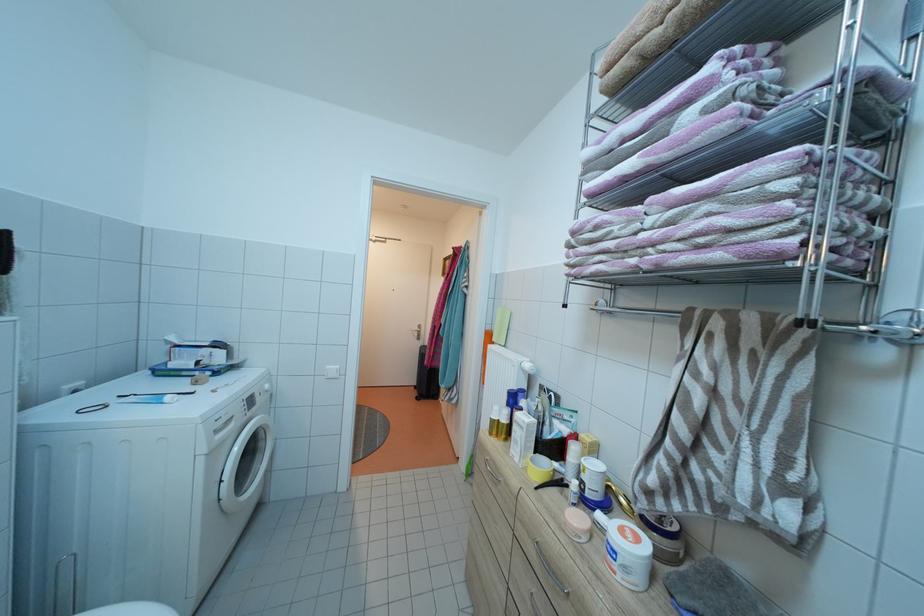
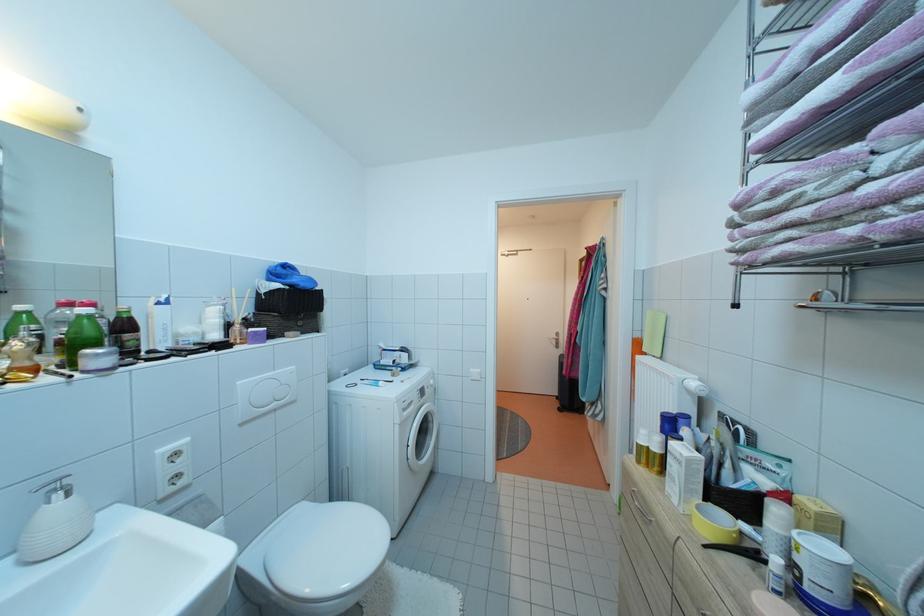
Where in the second image is the point corresponding to the point at 229,400 from the first image?

(415, 391)